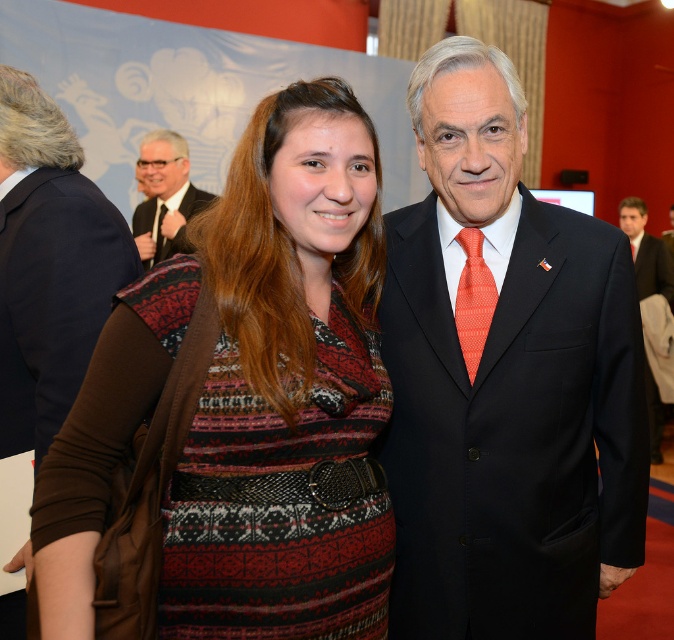
You are a photographer adjusting your camera settings. You notice the knitted sweater at center in the image. Based on its position, can you determine if it will be in the frame if you zoom in to focus on the two people posing?

The knitted sweater at center is located at point (247, 401), which means it is centrally positioned within the frame. When zooming in to focus on the two people, the sweater will likely remain in the frame as it is centrally located.

Consider the image. You are a photographer adjusting your camera settings. You notice two items in the scene that are both at the center of the image. The first is the dark blue suit at center, and the second is the matte black tie at center. Which of these two items is closer to your camera?

The dark blue suit at center is closer to the camera than the matte black tie at center.

You are a photographer trying to capture a group photo of the dark blue suit at center and the other person. The minimum distance required between subjects for your camera lens to focus properly is 4 meters. Can you take the photo without adjusting their positions?

The dark blue suit at center and the other person are 4.39 meters apart, which exceeds the minimum required distance of 4 meters. Therefore, you can take the photo without adjusting their positions.